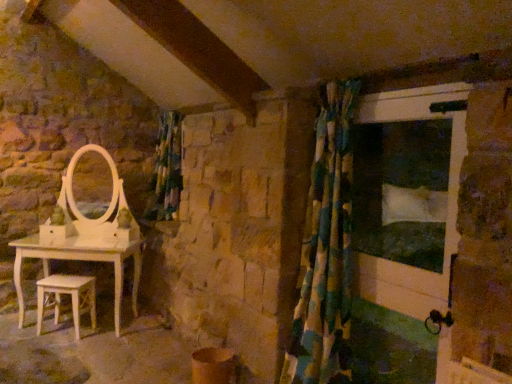
Question: Is white painted wood screen door at right inside or outside of multicolored fabric shower curtain at right?

Choices:
 (A) outside
 (B) inside

Answer: (A)

Question: In terms of width, does white painted wood screen door at right look wider or thinner when compared to multicolored fabric shower curtain at right?

Choices:
 (A) thin
 (B) wide

Answer: (A)

Question: Which object is the farthest from the multicolored fabric shower curtain at right?

Choices:
 (A) white wooden stool at lower left
 (B) green fabric curtain at center
 (C) white painted wood screen door at right

Answer: (A)

Question: Estimate the real-world distances between objects in this image. Which object is closer to the green fabric curtain at center?

Choices:
 (A) multicolored fabric shower curtain at right
 (B) white painted wood screen door at right
 (C) white wooden stool at lower left

Answer: (C)